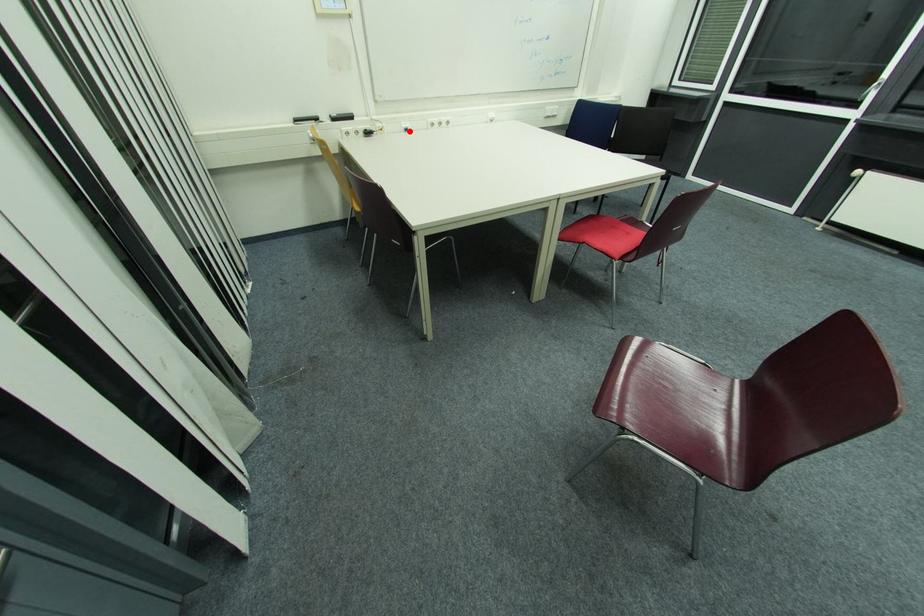
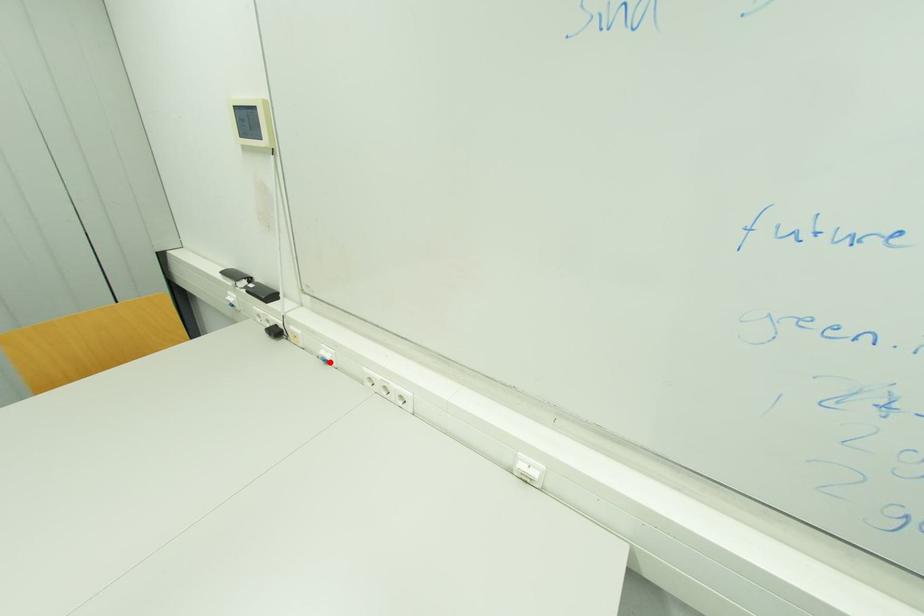
I am providing you with two images of the same scene from different viewpoints. A red point is marked on the first image and another point is marked on the second image. Does the point marked in image1 correspond to the same location as the one in image2?

Yes